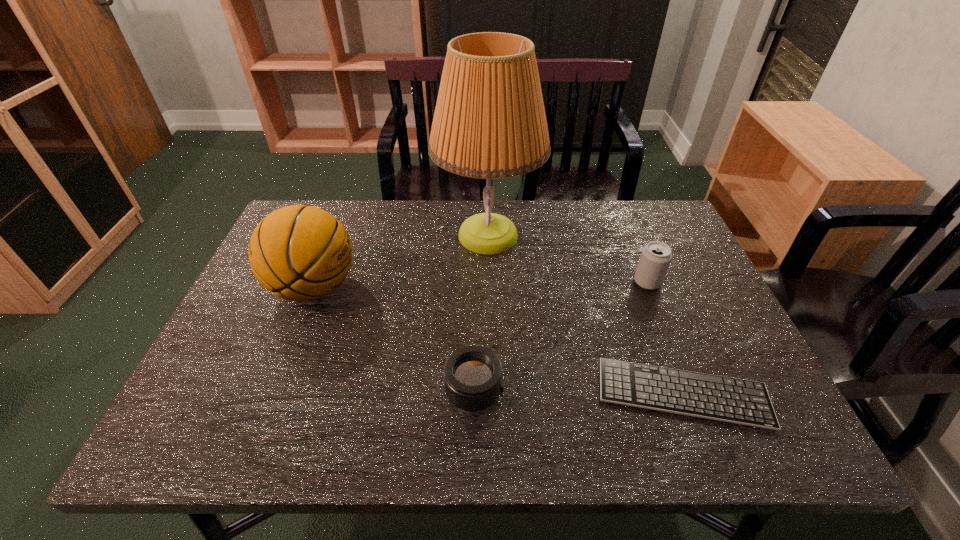
This screenshot has width=960, height=540. What are the coordinates of `vacant space that satisfies the following two spatial constraints: 1. on the surface of the basketball near the brand logo; 2. on the right side of the computer keyboard` in the screenshot? It's located at (274, 393).

Locate an element on the screen. The height and width of the screenshot is (540, 960). vacant point that satisfies the following two spatial constraints: 1. on the side of the lamp near the pull switch; 2. on the right side of the computer keyboard is located at coordinates (492, 393).

The image size is (960, 540). In order to click on free space that satisfies the following two spatial constraints: 1. on the side of the tallest object near the pull switch; 2. on the back side of the shortest object in this screenshot , I will do `click(492, 393)`.

Find the location of `free space that satisfies the following two spatial constraints: 1. on the side of the tallest object near the pull switch; 2. on the back side of the third tallest object`. free space that satisfies the following two spatial constraints: 1. on the side of the tallest object near the pull switch; 2. on the back side of the third tallest object is located at coordinates (489, 282).

Locate an element on the screen. free spot that satisfies the following two spatial constraints: 1. on the surface of the leftmost object near the brand logo; 2. on the right side of the computer keyboard is located at coordinates (274, 393).

Where is `blank space that satisfies the following two spatial constraints: 1. on the front side of the can; 2. on the side of the telephoto lens with brand markings and control switches`? Image resolution: width=960 pixels, height=540 pixels. blank space that satisfies the following two spatial constraints: 1. on the front side of the can; 2. on the side of the telephoto lens with brand markings and control switches is located at coordinates [691, 390].